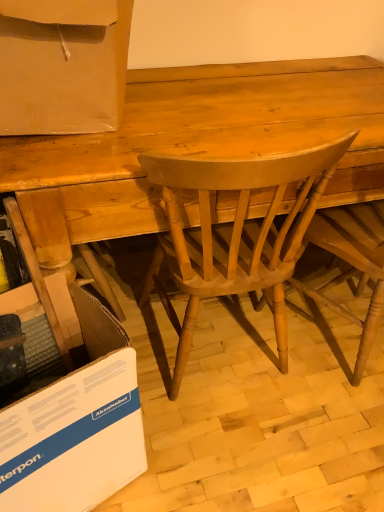
Question: Would you say light brown wood chair at center, arranged as the 2th chair when viewed from the right, is to the left or to the right of light brown wood desk at center in the picture?

Choices:
 (A) left
 (B) right

Answer: (A)

Question: Looking at their shapes, would you say light brown wood chair at center, arranged as the 2th chair when viewed from the right, is wider or thinner than light brown wood desk at center?

Choices:
 (A) wide
 (B) thin

Answer: (B)

Question: Estimate the real-world distances between objects in this image. Which object is farther from the light brown wood chair at center, which is the 1th chair from left to right?

Choices:
 (A) matte cardboard box at upper left
 (B) light brown wood chair at center, the second chair viewed from the left
 (C) light brown wood desk at center
 (D) white cardboard at lower left

Answer: (A)

Question: Estimate the real-world distances between objects in this image. Which object is closer to the light brown wood chair at center, arranged as the first chair when viewed from the right?

Choices:
 (A) white cardboard at lower left
 (B) light brown wood desk at center
 (C) light brown wood chair at center, arranged as the 2th chair when viewed from the right
 (D) matte cardboard box at upper left

Answer: (C)